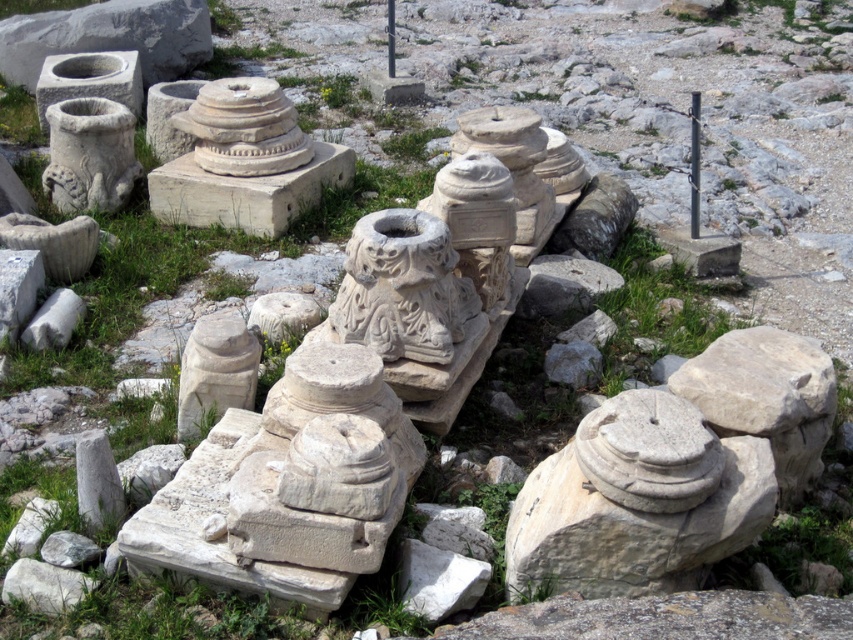
Question: Does white stone sculpture at center come behind white stone column at center?

Choices:
 (A) yes
 (B) no

Answer: (B)

Question: Is white stone sculpture at center thinner than white stone basin at upper left?

Choices:
 (A) no
 (B) yes

Answer: (B)

Question: Which point is closer to the camera?

Choices:
 (A) (393, 19)
 (B) (698, 172)
 (C) (378, 292)

Answer: (C)

Question: Among these points, which one is farthest from the camera?

Choices:
 (A) (363, 305)
 (B) (390, 54)
 (C) (691, 109)
 (D) (79, 51)

Answer: (C)

Question: Estimate the real-world distances between objects in this image. Which object is closer to the white stone basin at upper left?

Choices:
 (A) white stone pillar at center
 (B) white stone sculpture at center
 (C) white stone column at center

Answer: (C)

Question: Is white stone basin at upper left positioned at the back of white stone pillar at center?

Choices:
 (A) no
 (B) yes

Answer: (A)